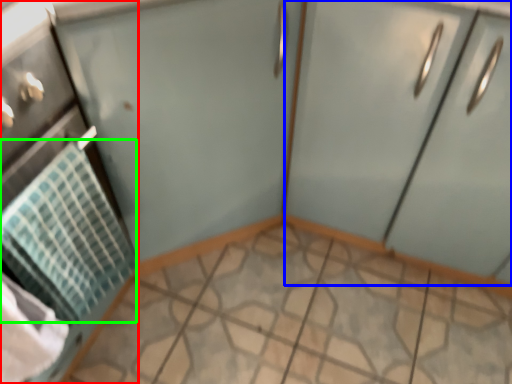
Question: Which is farther away from appliance (highlighted by a red box)? cabinetry (highlighted by a blue box) or blanket (highlighted by a green box)?

Choices:
 (A) cabinetry
 (B) blanket

Answer: (A)